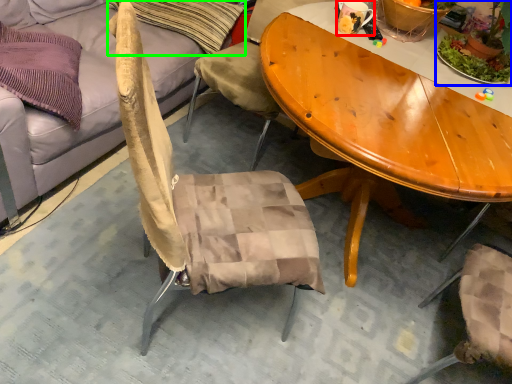
Question: Based on their relative distances, which object is farther from coffee cup (highlighted by a red box)? Choose from houseplant (highlighted by a blue box) and pillow (highlighted by a green box).

Choices:
 (A) houseplant
 (B) pillow

Answer: (B)